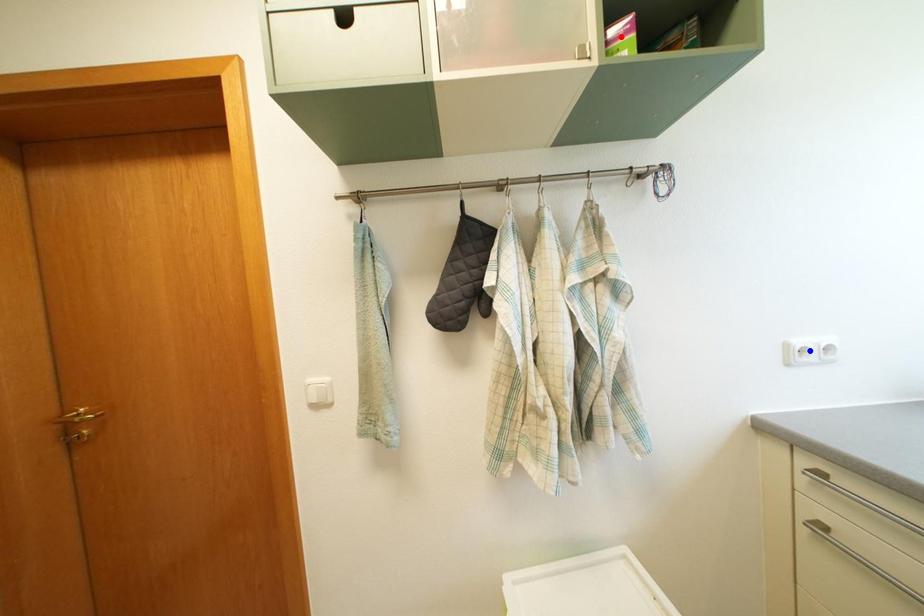
Question: Two points are marked on the image. Which point is closer to the camera?

Choices:
 (A) Blue point is closer.
 (B) Red point is closer.

Answer: (B)